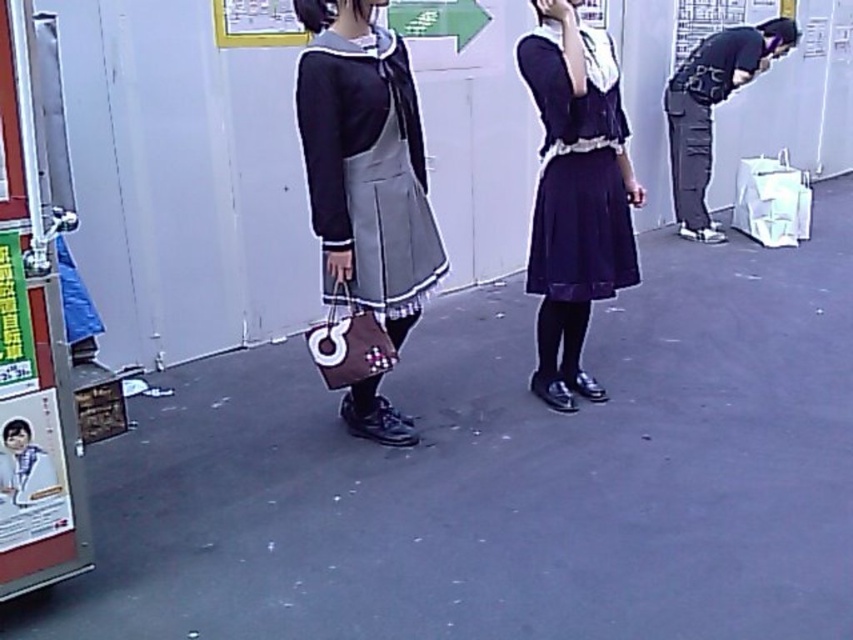
Does dark gray pants at right appear on the left side of dark gray fabric pants at right?

In fact, dark gray pants at right is to the right of dark gray fabric pants at right.

Identify the location of dark gray pants at right. (711, 108).

Is matte black sweater at center bigger than navy satin dress at center?

Correct, matte black sweater at center is larger in size than navy satin dress at center.

Which of these two, matte black sweater at center or navy satin dress at center, stands shorter?

navy satin dress at center

What do you see at coordinates (364, 163) in the screenshot?
I see `matte black sweater at center` at bounding box center [364, 163].

Locate an element on the screen. The width and height of the screenshot is (853, 640). matte black sweater at center is located at coordinates (364, 163).

Between point (389, 422) and point (705, 173), which one is positioned behind?

The point (705, 173) is more distant.

Who is lower down, matte black sweater at center or dark gray fabric pants at right?

Positioned lower is matte black sweater at center.

Which is behind, point (344, 61) or point (686, 131)?

Point (686, 131)

Identify the location of matte black sweater at center. (364, 163).